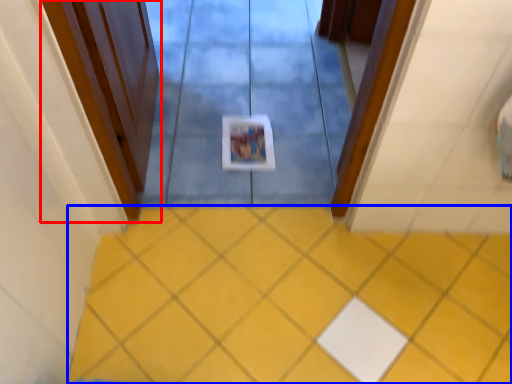
Question: Which of the following is the farthest to the observer, door (highlighted by a red box) or ceramic tile (highlighted by a blue box)?

Choices:
 (A) door
 (B) ceramic tile

Answer: (B)